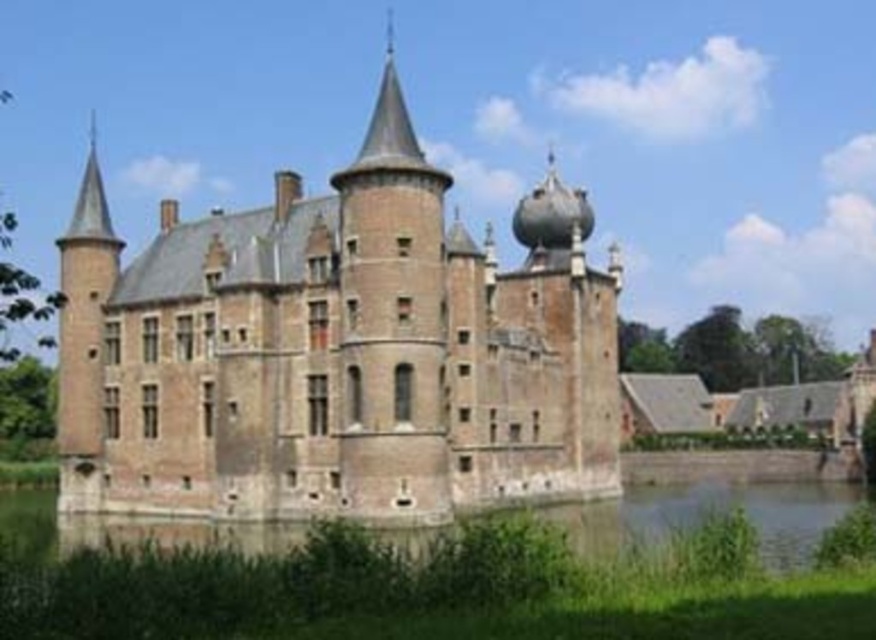
Question: Is brown brick castle at center below brown stone wall at lower center?

Choices:
 (A) no
 (B) yes

Answer: (A)

Question: Does brown brick castle at center have a greater width compared to brown stone wall at lower center?

Choices:
 (A) yes
 (B) no

Answer: (B)

Question: Is the position of brown brick castle at center less distant than that of brown stone wall at lower center?

Choices:
 (A) no
 (B) yes

Answer: (A)